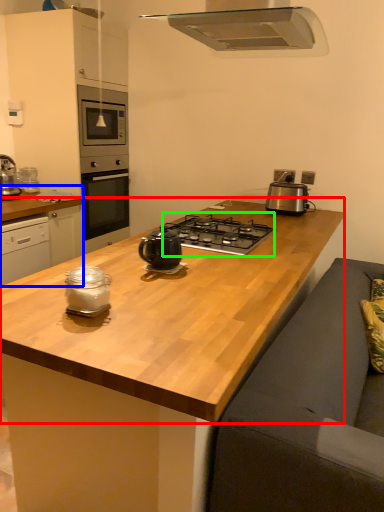
Question: Which object is the farthest from countertop (highlighted by a red box)? Choose among these: cabinetry (highlighted by a blue box) or gas stove (highlighted by a green box).

Choices:
 (A) cabinetry
 (B) gas stove

Answer: (A)